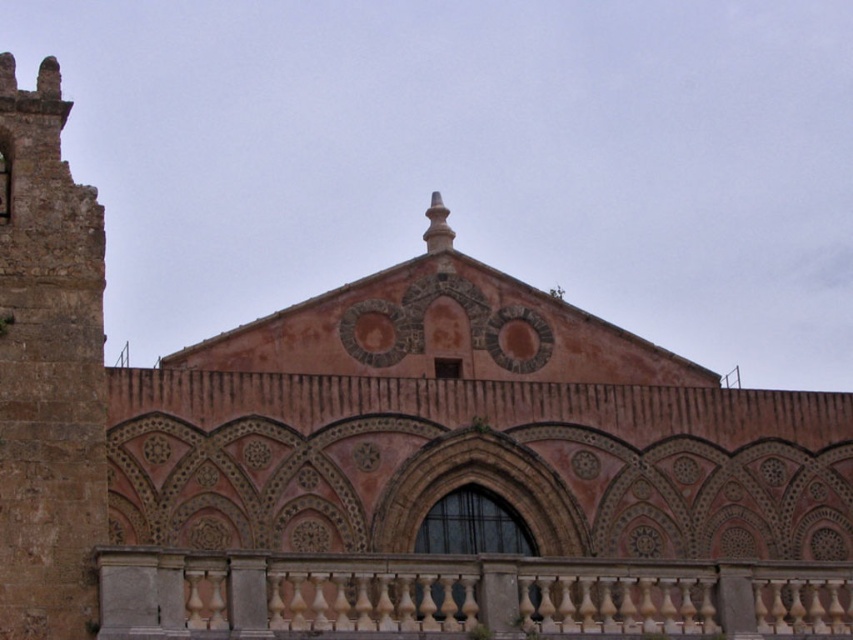
From the picture: You are standing in front of the historical building and want to locate the beige marble balustrade at lower center. According to the coordinates provided, where should you look?

The beige marble balustrade at lower center is located at point (460, 596).

You are a visitor standing in front of the historical building. You want to walk from the beige marble balustrade at lower center to the rustic stone tower at left. Which direction should you move to reach the tower?

To reach the rustic stone tower at left from the beige marble balustrade at lower center, you should move to the left since the tower is positioned to the left of the balustrade.